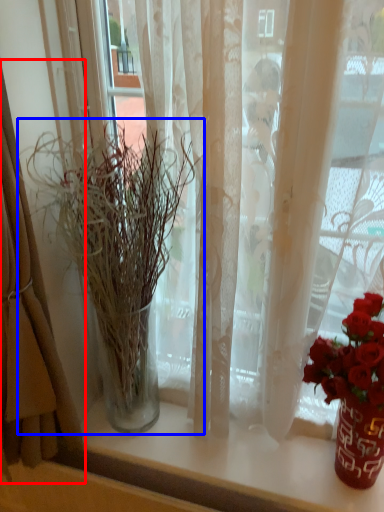
Question: Which point is further to the camera, curtain (highlighted by a red box) or houseplant (highlighted by a blue box)?

Choices:
 (A) curtain
 (B) houseplant

Answer: (B)